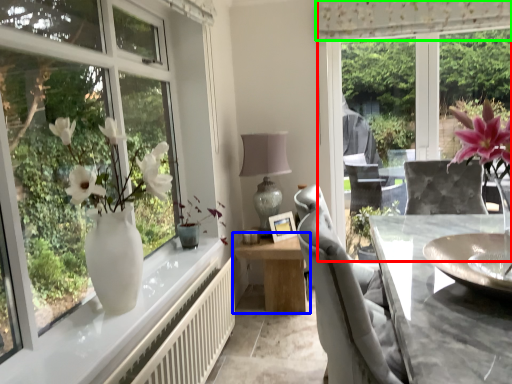
Question: Which is farther away from window screen (highlighted by a red box)? table (highlighted by a blue box) or curtain (highlighted by a green box)?

Choices:
 (A) table
 (B) curtain

Answer: (A)